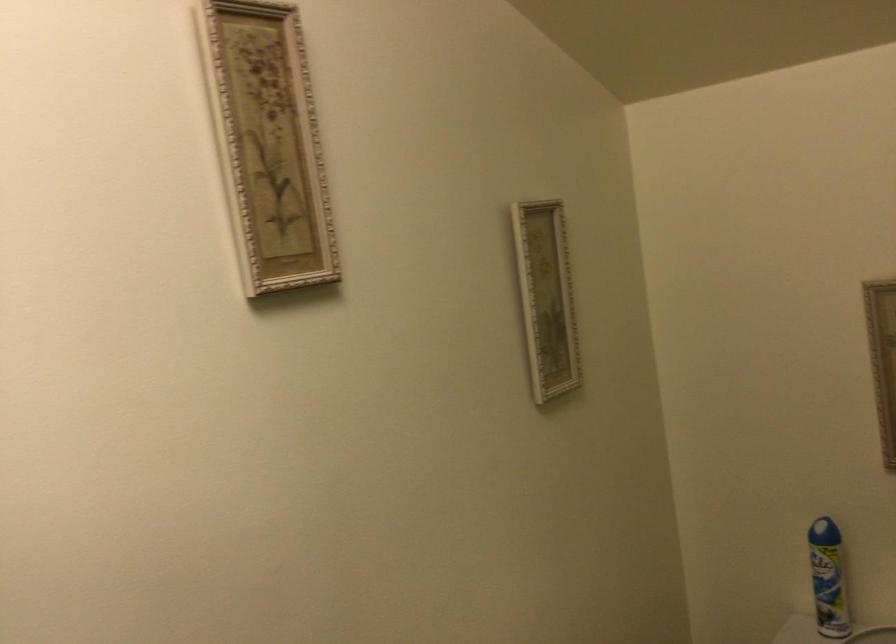
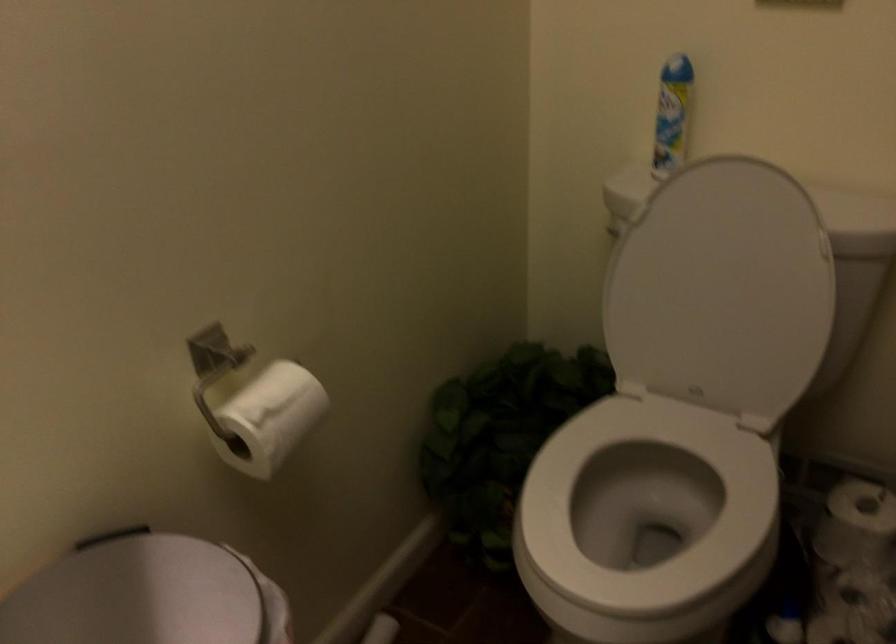
Question: The images are taken continuously from a first-person perspective. In which direction is your viewpoint rotating?

Choices:
 (A) Left
 (B) Right
 (C) Up
 (D) Down

Answer: (D)